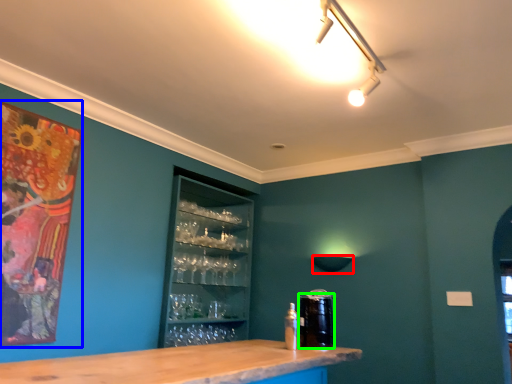
Question: Estimate the real-world distances between objects in this image. Which object is farther from lamp (highlighted by a red box), picture frame (highlighted by a blue box) or beverage (highlighted by a green box)?

Choices:
 (A) picture frame
 (B) beverage

Answer: (A)